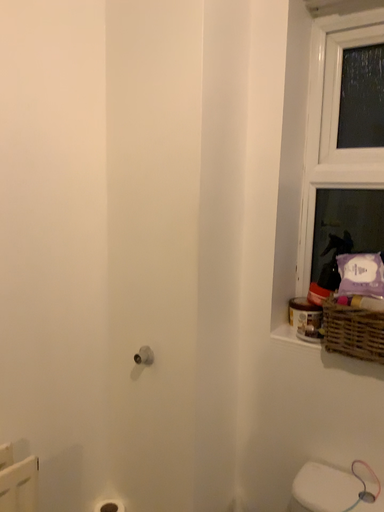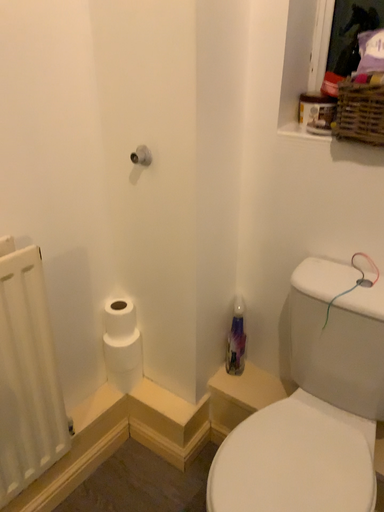
Question: How did the camera likely rotate when shooting the video?

Choices:
 (A) rotated upward
 (B) rotated downward

Answer: (B)